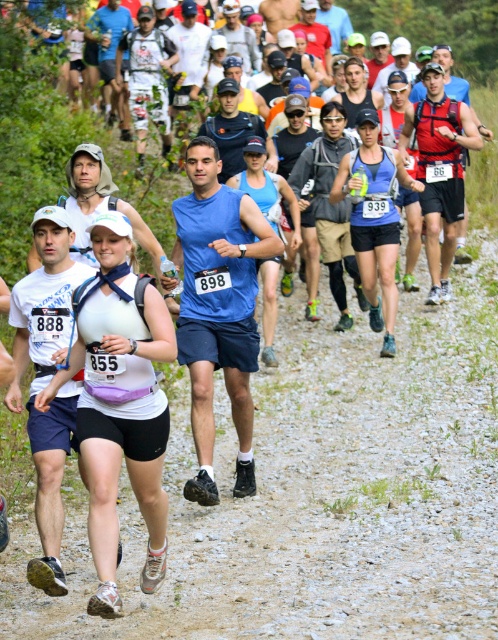
Question: Which point is closer to the camera taking this photo?

Choices:
 (A) (234, 520)
 (B) (233, 332)

Answer: (A)

Question: From the image, what is the correct spatial relationship of white matte tank top at center in relation to blue fabric tank top at center?

Choices:
 (A) below
 (B) above

Answer: (A)

Question: Can you confirm if white fabric runner at center is wider than blue fabric tank top at center?

Choices:
 (A) no
 (B) yes

Answer: (A)

Question: Which object is farther from the camera taking this photo?

Choices:
 (A) white matte tank top at center
 (B) blue fabric tank top at center

Answer: (B)

Question: Estimate the real-world distances between objects in this image. Which object is closer to the white matte tank top at center?

Choices:
 (A) blue fabric tank top at center
 (B) white fabric runner at center

Answer: (A)

Question: Is white fabric runner at center positioned in front of blue fabric tank top at center?

Choices:
 (A) no
 (B) yes

Answer: (A)